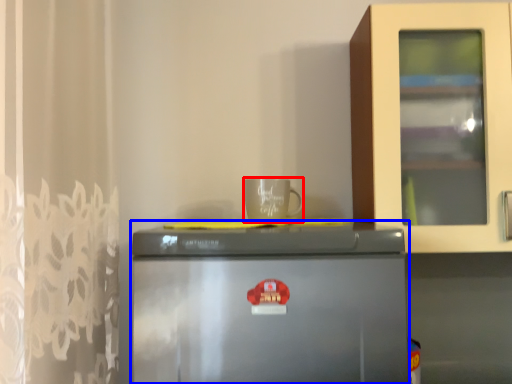
Question: Which of the following is the farthest to the observer, coffee cup (highlighted by a red box) or refrigerator (highlighted by a blue box)?

Choices:
 (A) coffee cup
 (B) refrigerator

Answer: (A)